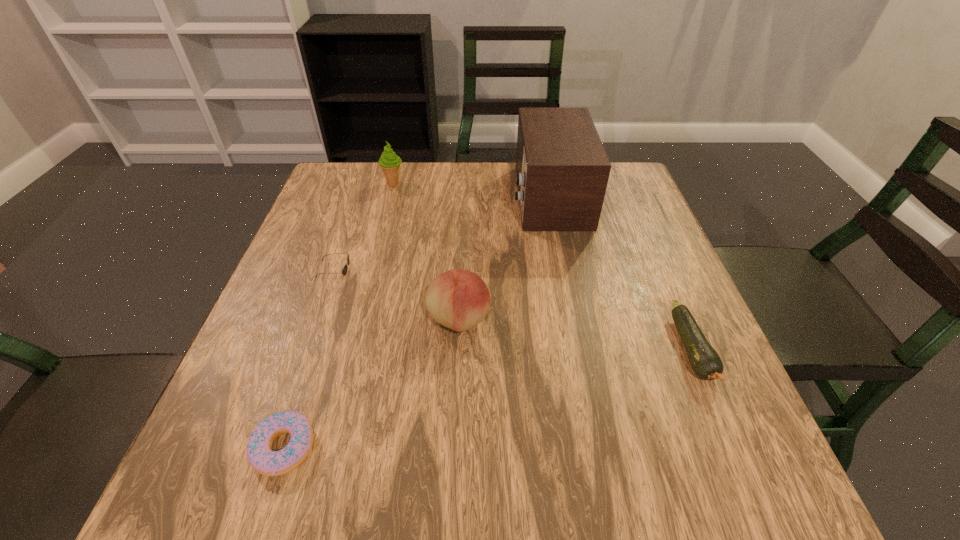
You are a GUI agent. You are given a task and a screenshot of the screen. Output one action in this format:
    pyautogui.click(x=<x>, y=<y>)
    Task: Click on the object that is at the near edge
    This screenshot has width=960, height=540.
    Given the screenshot: What is the action you would take?
    pyautogui.click(x=259, y=452)

I want to click on icecream that is positioned at the left edge, so click(390, 163).

The height and width of the screenshot is (540, 960). Find the location of `sunglasses present at the left edge`. sunglasses present at the left edge is located at coordinates (344, 271).

This screenshot has width=960, height=540. Identify the location of doughnut located at the left edge. (259, 452).

Where is `radio receiver that is at the right edge`? The width and height of the screenshot is (960, 540). radio receiver that is at the right edge is located at coordinates click(562, 170).

This screenshot has height=540, width=960. I want to click on zucchini that is at the right edge, so click(704, 360).

At what (x,y) coordinates should I click in order to perform the action: click on object present at the far left corner. Please return your answer as a coordinate pair (x, y). This screenshot has height=540, width=960. Looking at the image, I should click on (390, 163).

This screenshot has width=960, height=540. In order to click on object that is at the near left corner in this screenshot , I will do `click(259, 452)`.

Where is `object that is at the far right corner`? This screenshot has width=960, height=540. object that is at the far right corner is located at coordinates (562, 170).

In the image, there is a desktop. Where is `vacant space at the far edge`? This screenshot has width=960, height=540. vacant space at the far edge is located at coordinates (432, 186).